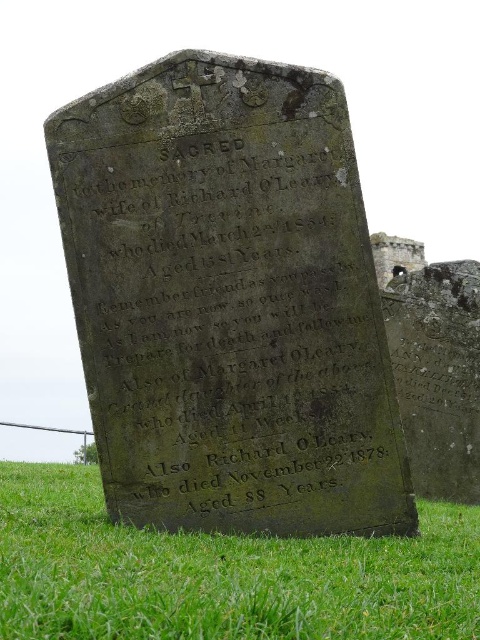
Question: In this image, where is weathered stone monument at center located relative to black stone gravestone at lower center?

Choices:
 (A) below
 (B) above

Answer: (B)

Question: Which point is farther to the camera?

Choices:
 (A) black stone gravestone at lower center
 (B) weathered stone monument at center

Answer: (B)

Question: Can you confirm if weathered stone monument at center is positioned to the left of black stone gravestone at lower center?

Choices:
 (A) yes
 (B) no

Answer: (A)

Question: Is weathered stone monument at center bigger than black stone gravestone at lower center?

Choices:
 (A) no
 (B) yes

Answer: (A)